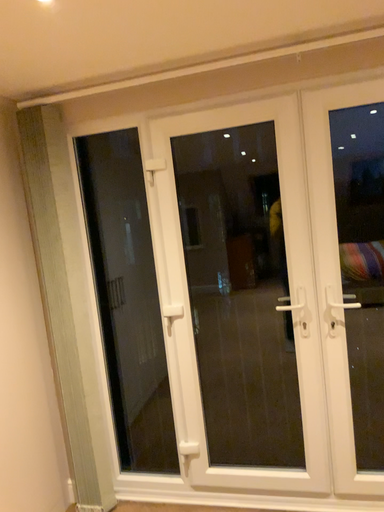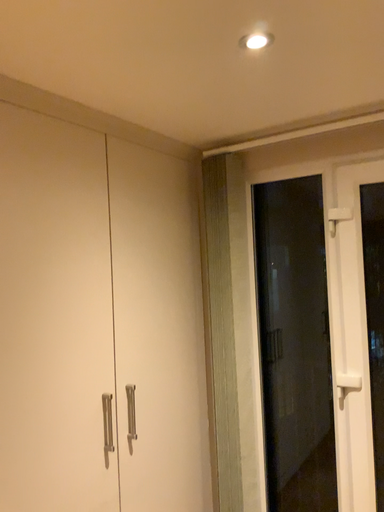
Question: Which way did the camera rotate in the video?

Choices:
 (A) rotated left
 (B) rotated right

Answer: (A)